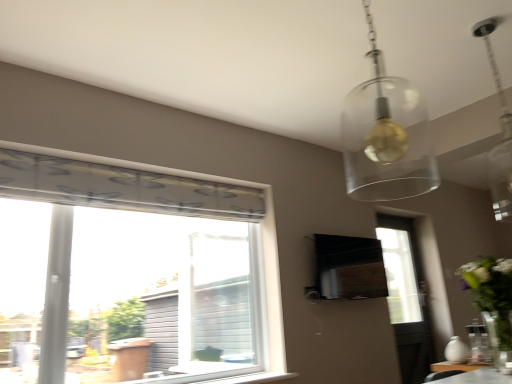
What do you see at coordinates (252, 378) in the screenshot?
I see `white plastic window sill at lower center` at bounding box center [252, 378].

At what (x,y) coordinates should I click in order to perform the action: click on white matte vase at lower right. Please return your answer as a coordinate pair (x, y). The image size is (512, 384). Looking at the image, I should click on (457, 351).

Where is `white plastic window sill at lower center`? Image resolution: width=512 pixels, height=384 pixels. white plastic window sill at lower center is located at coordinates pos(252,378).

Looking at this image, how different are the orientations of white matte vase at lower right and clear glass pendant light at upper right in degrees?

The angular difference between white matte vase at lower right and clear glass pendant light at upper right is 165 degrees.

From the picture: From the image's perspective, is white matte vase at lower right over clear glass pendant light at upper right?

No, from the image's perspective, white matte vase at lower right is not on top of clear glass pendant light at upper right.

Can clear glass pendant light at upper right be found inside white matte vase at lower right?

Actually, clear glass pendant light at upper right is outside white matte vase at lower right.

Is point (447, 348) less distant than point (490, 165)?

Yes, point (447, 348) is closer to viewer.

Locate an element on the screen. window sill behind the translucent glass globe at upper center is located at coordinates (252, 378).

What's the angular difference between translucent glass globe at upper center and white plastic window sill at lower center's facing directions?

The facing directions of translucent glass globe at upper center and white plastic window sill at lower center are 88.9 degrees apart.

Based on the photo, from a real-world perspective, is translucent glass globe at upper center under white plastic window sill at lower center?

No, from a real-world perspective, translucent glass globe at upper center is not beneath white plastic window sill at lower center.

Considering the relative positions of translucent glass globe at upper center and white plastic window sill at lower center in the image provided, is translucent glass globe at upper center to the right of white plastic window sill at lower center from the viewer's perspective?

Yes, translucent glass globe at upper center is to the right of white plastic window sill at lower center.

Is clear glass pendant light at upper right wider or thinner than translucent glass globe at upper center?

clear glass pendant light at upper right is thinner than translucent glass globe at upper center.

Considering the relative positions of clear glass pendant light at upper right and translucent glass globe at upper center in the image provided, is clear glass pendant light at upper right behind translucent glass globe at upper center?

Yes, it is behind translucent glass globe at upper center.

Considering the relative sizes of clear glass pendant light at upper right and translucent glass globe at upper center in the image provided, is clear glass pendant light at upper right smaller than translucent glass globe at upper center?

Yes.

Is clear glass pendant light at upper right inside or outside of black matte vent at center?

clear glass pendant light at upper right is not inside black matte vent at center, it's outside.

Is clear glass pendant light at upper right looking in the opposite direction of black matte vent at center?

No.

From the image's perspective, is clear glass pendant light at upper right on black matte vent at center?

Yes.

Is clear glass pendant light at upper right directly adjacent to black matte vent at center?

There is a gap between clear glass pendant light at upper right and black matte vent at center.

Is point (248, 380) closer or farther from the camera than point (396, 82)?

Point (248, 380) is positioned farther from the camera compared to point (396, 82).

Identify the location of window sill on the left of translucent glass globe at upper center. (252, 378).

Can you confirm if white plastic window sill at lower center is wider than translucent glass globe at upper center?

In fact, white plastic window sill at lower center might be narrower than translucent glass globe at upper center.

Between black matte vent at center and translucent glass globe at upper center, which one has less height?

With less height is black matte vent at center.

Is black matte vent at center to the right of translucent glass globe at upper center from the viewer's perspective?

Yes, black matte vent at center is to the right of translucent glass globe at upper center.

From the image's perspective, is black matte vent at center above or below white matte vase at lower right?

black matte vent at center is above white matte vase at lower right.

Image resolution: width=512 pixels, height=384 pixels. Find the location of `vent above the white matte vase at lower right (from the image's perspective)`. vent above the white matte vase at lower right (from the image's perspective) is located at coordinates (349, 267).

Is black matte vent at center oriented away from white matte vase at lower right?

black matte vent at center does not have its back to white matte vase at lower right.

Would you say black matte vent at center is a long distance from white matte vase at lower right?

No, black matte vent at center is not far from white matte vase at lower right.

The height and width of the screenshot is (384, 512). In the image, there is a clear glass pendant light at upper right. Find the location of `vase below it (from the image's perspective)`. vase below it (from the image's perspective) is located at coordinates (457, 351).

Where is `window sill behind the translucent glass globe at upper center`? This screenshot has height=384, width=512. window sill behind the translucent glass globe at upper center is located at coordinates (252, 378).

Considering their positions, is translucent glass globe at upper center positioned closer to white matte vase at lower right than black matte vent at center?

The object closer to white matte vase at lower right is black matte vent at center.

Estimate the real-world distances between objects in this image. Which object is closer to clear glass pendant light at upper right, translucent glass globe at upper center or black matte vent at center?

Among the two, translucent glass globe at upper center is located nearer to clear glass pendant light at upper right.

From the image, which object appears to be farther from white matte vase at lower right, white glossy vase at right or clear glass pendant light at upper right?

clear glass pendant light at upper right is positioned further to the anchor white matte vase at lower right.

From the picture: Based on their spatial positions, is white matte vase at lower right or translucent glass globe at upper center closer to white glossy vase at right?

white matte vase at lower right lies closer to white glossy vase at right than the other object.

Estimate the real-world distances between objects in this image. Which object is further from black matte vent at center, translucent glass globe at upper center or white matte vase at lower right?

white matte vase at lower right is positioned further to the anchor black matte vent at center.

Consider the image. Looking at the image, which one is located further to white plastic window sill at lower center, translucent glass globe at upper center or clear glass pendant light at upper right?

Among the two, clear glass pendant light at upper right is located further to white plastic window sill at lower center.

When comparing their distances from white plastic window sill at lower center, does black matte vent at center or white matte vase at lower right seem further?

white matte vase at lower right lies further to white plastic window sill at lower center than the other object.

Which object lies further to the anchor point white matte vase at lower right, white plastic window sill at lower center or translucent glass globe at upper center?

translucent glass globe at upper center is further to white matte vase at lower right.

Image resolution: width=512 pixels, height=384 pixels. Identify the location of floral arrangement between clear glass pendant light at upper right and black matte vent at center from front to back. (490, 292).

The width and height of the screenshot is (512, 384). I want to click on vase between white plastic window sill at lower center and white glossy vase at right from left to right, so click(x=457, y=351).

Image resolution: width=512 pixels, height=384 pixels. Find the location of `window sill between translucent glass globe at upper center and black matte vent at center in the front-back direction`. window sill between translucent glass globe at upper center and black matte vent at center in the front-back direction is located at coordinates (252, 378).

The height and width of the screenshot is (384, 512). Identify the location of light fixture between translucent glass globe at upper center and white plastic window sill at lower center in the up-down direction. tap(501, 132).